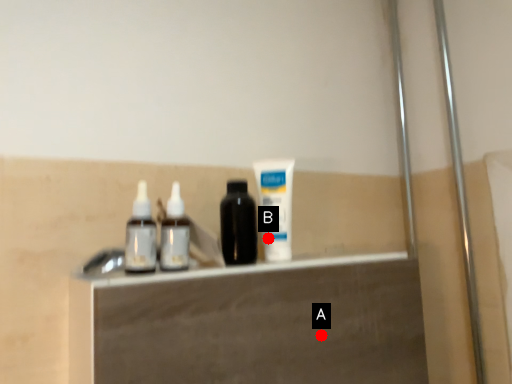
Question: Two points are circled on the image, labeled by A and B beside each circle. Which of the following is the farthest from the observer?

Choices:
 (A) A is further
 (B) B is further

Answer: (B)